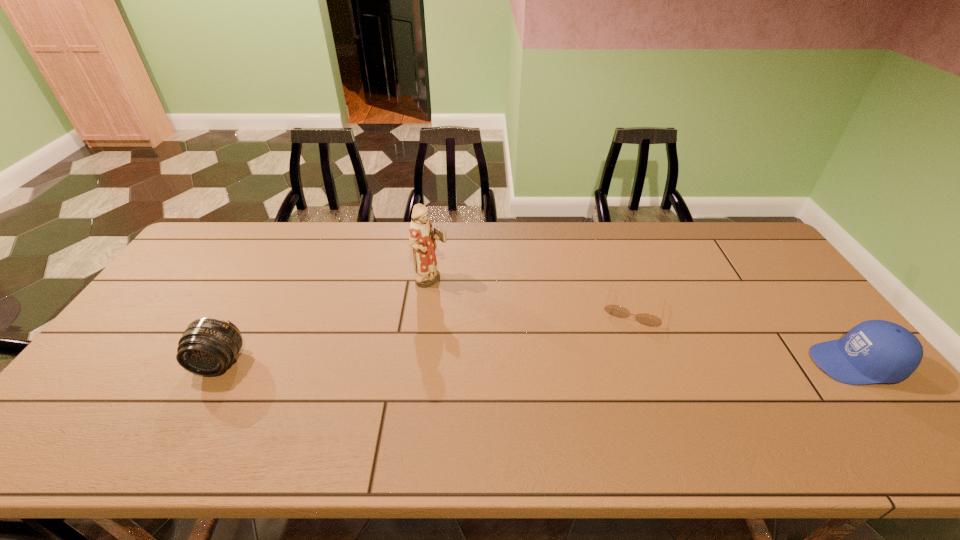
I want to click on object that stands as the second closest to the rightmost object, so click(x=422, y=238).

Image resolution: width=960 pixels, height=540 pixels. I want to click on free space that satisfies the following two spatial constraints: 1. on the front side of the third object from left to right; 2. on the front-facing side of the rightmost object, so click(x=655, y=363).

Image resolution: width=960 pixels, height=540 pixels. I want to click on vacant space that satisfies the following two spatial constraints: 1. at the front element of the leftmost object; 2. on the front-facing side of the cap, so [x=220, y=363].

In order to click on vacant area that satisfies the following two spatial constraints: 1. on the front side of the rightmost object; 2. on the front-facing side of the tallest object in this screenshot , I will do `click(421, 363)`.

Locate an element on the screen. The width and height of the screenshot is (960, 540). blank space that satisfies the following two spatial constraints: 1. at the front element of the telephoto lens; 2. on the front-facing side of the cap is located at coordinates (220, 363).

Image resolution: width=960 pixels, height=540 pixels. I want to click on vacant area that satisfies the following two spatial constraints: 1. at the front element of the rightmost object; 2. on the front-facing side of the telephoto lens, so click(x=220, y=363).